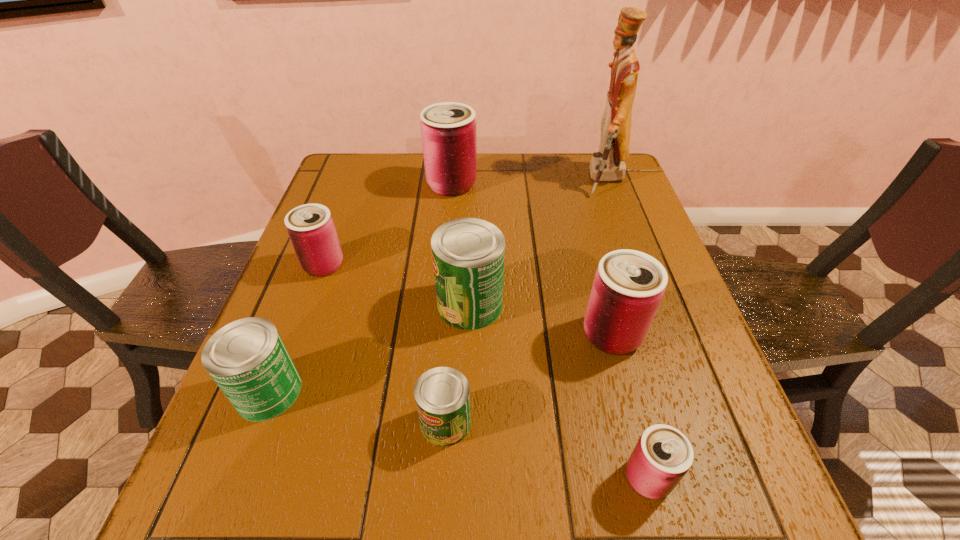
Find the location of `the smallest pink can`. the smallest pink can is located at coordinates (662, 456).

Where is `the nearest object`? the nearest object is located at coordinates (662, 456).

I want to click on free space located 0.330m on the front-facing side of the nutcracker, so click(471, 179).

Locate an element on the screen. The height and width of the screenshot is (540, 960). free point located on the front-facing side of the nutcracker is located at coordinates (447, 179).

Locate an element on the screen. The image size is (960, 540). vacant space located 0.200m on the front-facing side of the nutcracker is located at coordinates (516, 179).

The height and width of the screenshot is (540, 960). Find the location of `free location located 0.100m on the front of the second pink can from left to right`. free location located 0.100m on the front of the second pink can from left to right is located at coordinates (448, 221).

I want to click on vacant space located 0.240m on the front of the farthest green can, so click(467, 444).

At what (x,y) coordinates should I click in order to perform the action: click on vacant space situated 0.050m on the front of the third farthest pink can. Please return your answer as a coordinate pair (x, y). This screenshot has width=960, height=540. Looking at the image, I should click on (625, 382).

This screenshot has width=960, height=540. I want to click on free space located on the front of the third biggest pink can, so click(x=282, y=379).

Image resolution: width=960 pixels, height=540 pixels. What are the coordinates of `vacant space located 0.400m on the right of the second smallest green can` in the screenshot? It's located at (520, 392).